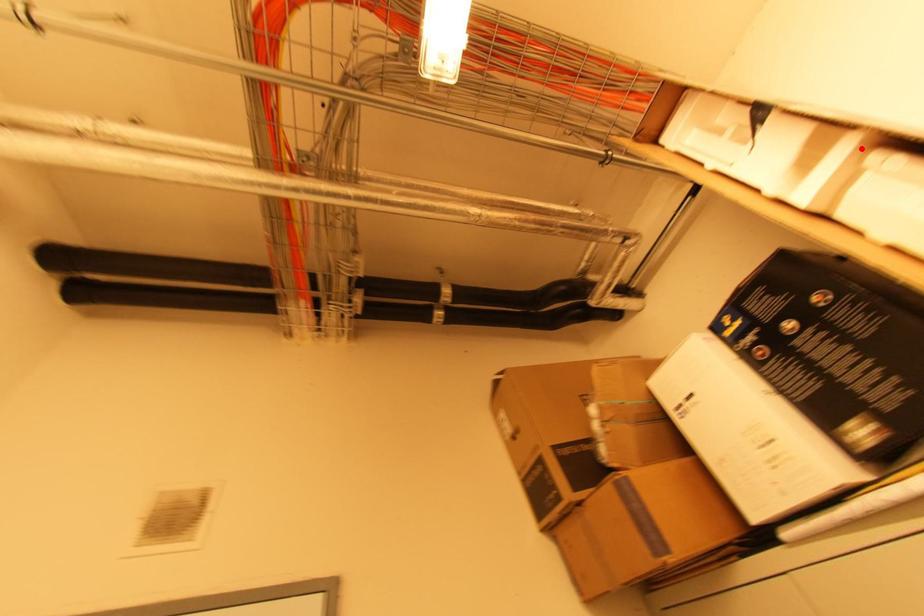
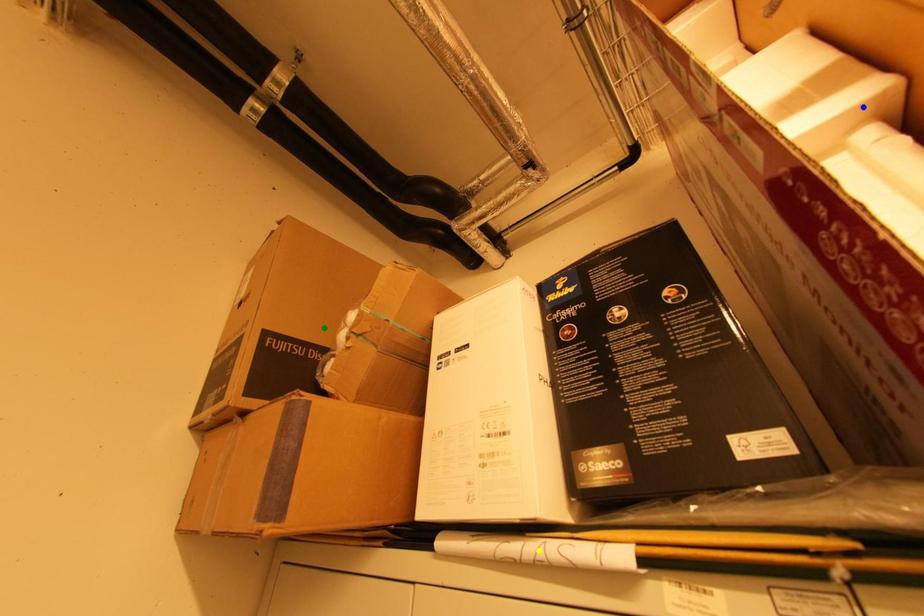
Question: I am providing you with two images of the same scene from different viewpoints. A red point is marked on the first image. You are given multiple points on the second image. Can you choose the point in image 2 that corresponds to the point in image 1?

Choices:
 (A) green point
 (B) yellow point
 (C) blue point

Answer: (C)